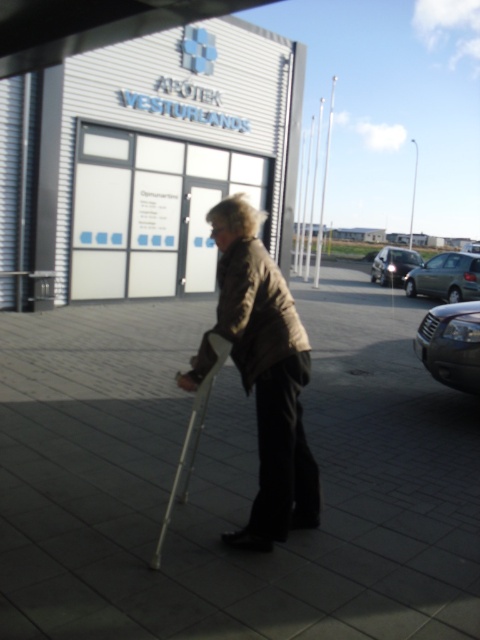
You are a delivery person who needs to park your 1.8 meters wide delivery van. You see the metallic gray sedan at right and the white plastic crutch at center. Which parking spot can accommodate your van based on their widths?

The metallic gray sedan at right has a larger width than the white plastic crutch at center. Since the van is 1.8 meters wide, it can fit in a spot that is wider than the sedan, but the description only compares their widths without specific measurements. Without exact dimensions, it is uncertain which parking spot is suitable. Please check the actual space available.

You are a delivery driver who needs to park your car next to the metallic gray sedan at right. However, there is a white plastic crutch at center in the way. Can you move the crutch to make space?

The metallic gray sedan at right is smaller than the white plastic crutch at center, so moving the crutch would free up more space for parking.